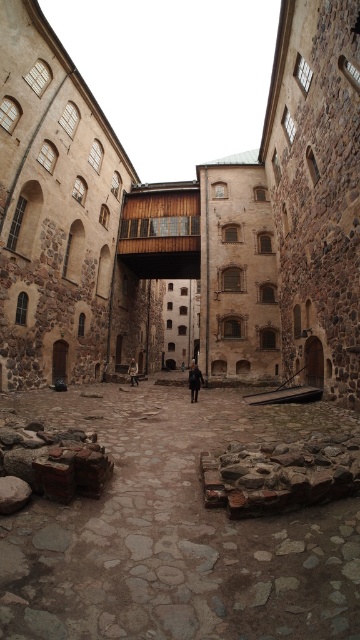
You are an architect examining the courtyard. You notice two areas labeled as the brown stone courtyard at center and the rustic stone courtyard at center. Which area has a larger surface area?

The brown stone courtyard at center has a larger surface area than the rustic stone courtyard at center.

Looking at this image, you are standing in the courtyard and see the rustic stone courtyard at center and the brown leather jacket at center. Which object is positioned to the right of the other?

The rustic stone courtyard at center is to the right of the brown leather jacket at center.

You are a visitor in the courtyard and want to know if you can place your dark brown leather coat at center on the brown stone courtyard at center without it hanging over the edges. Can you confirm based on their sizes?

The brown stone courtyard at center is wider than the dark brown leather coat at center, so yes, the coat can be placed on the courtyard without overhanging.